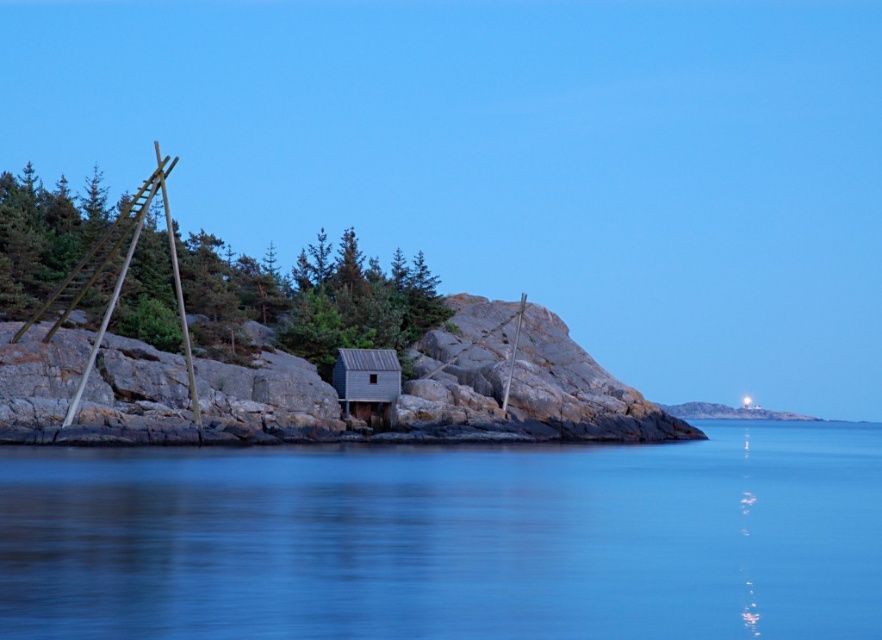
You are a delivery drone with a maximum flight range of 100 feet. You need to deliver a package to the wooden cabin at center from the blue smooth water at center. Can you make the delivery without needing to recharge?

The distance between blue smooth water at center and wooden cabin at center is 103.52 feet, which exceeds your drone maximum flight range of 100 feet. You will need to recharge before completing the delivery.